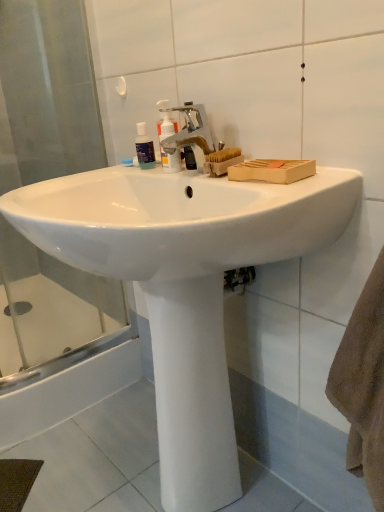
The height and width of the screenshot is (512, 384). What do you see at coordinates (165, 139) in the screenshot?
I see `translucent plastic pump bottle at center` at bounding box center [165, 139].

What do you see at coordinates (192, 395) in the screenshot? I see `white smooth pedestal at center` at bounding box center [192, 395].

Locate an element on the screen. translucent plastic pump bottle at center is located at coordinates (165, 139).

Is white smooth pedestal at center next to white glossy sink at center and touching it?

They are not placed beside each other.

Considering the relative sizes of white smooth pedestal at center and white glossy sink at center in the image provided, is white smooth pedestal at center bigger than white glossy sink at center?

Incorrect, white smooth pedestal at center is not larger than white glossy sink at center.

At what (x,y) coordinates should I click in order to perform the action: click on sink to the left of white smooth pedestal at center. Please return your answer as a coordinate pair (x, y). The height and width of the screenshot is (512, 384). Looking at the image, I should click on (179, 220).

Can you confirm if white smooth pedestal at center is positioned to the right of white glossy sink at center?

Indeed, white smooth pedestal at center is positioned on the right side of white glossy sink at center.

In the image, is silver metallic faucet at center positioned in front of or behind transparent plastic bottle at upper center?

silver metallic faucet at center is positioned closer to the viewer than transparent plastic bottle at upper center.

From the image's perspective, who appears lower, silver metallic faucet at center or transparent plastic bottle at upper center?

silver metallic faucet at center appears lower in the image.

Between silver metallic faucet at center and transparent plastic bottle at upper center, which one has smaller size?

Smaller between the two is transparent plastic bottle at upper center.

Is silver metallic faucet at center aimed at transparent plastic bottle at upper center?

No.

Would you say transparent plastic bottle at upper center is inside or outside translucent plastic pump bottle at center?

transparent plastic bottle at upper center is not enclosed by translucent plastic pump bottle at center.

From a real-world perspective, is transparent plastic bottle at upper center above or below translucent plastic pump bottle at center?

transparent plastic bottle at upper center is situated lower than translucent plastic pump bottle at center in the real world.

Is transparent plastic bottle at upper center thinner than translucent plastic pump bottle at center?

Yes, transparent plastic bottle at upper center is thinner than translucent plastic pump bottle at center.

Does transparent plastic bottle at upper center turn towards translucent plastic pump bottle at center?

No, transparent plastic bottle at upper center is not turned towards translucent plastic pump bottle at center.

Which object is more forward, transparent glass shower door at left or white smooth pedestal at center?

white smooth pedestal at center.

From a real-world perspective, is transparent glass shower door at left on top of white smooth pedestal at center?

Yes.

Is transparent glass shower door at left taller or shorter than white smooth pedestal at center?

transparent glass shower door at left is taller than white smooth pedestal at center.

Measure the distance from transparent glass shower door at left to white smooth pedestal at center.

transparent glass shower door at left and white smooth pedestal at center are 64.22 centimeters apart from each other.

Is white smooth pedestal at center bigger or smaller than transparent plastic bottle at upper center?

In the image, white smooth pedestal at center appears to be larger than transparent plastic bottle at upper center.

Could you tell me if white smooth pedestal at center is facing transparent plastic bottle at upper center?

No, white smooth pedestal at center is not turned towards transparent plastic bottle at upper center.

Are white smooth pedestal at center and transparent plastic bottle at upper center making contact?

white smooth pedestal at center is not next to transparent plastic bottle at upper center, and they're not touching.

Considering their positions, is translucent plastic pump bottle at center located in front of or behind transparent glass shower door at left?

Visually, translucent plastic pump bottle at center is located behind transparent glass shower door at left.

Is translucent plastic pump bottle at center not close to transparent glass shower door at left?

translucent plastic pump bottle at center is near transparent glass shower door at left, not far away.

Is transparent glass shower door at left at the back of translucent plastic pump bottle at center?

No, translucent plastic pump bottle at center's orientation is not away from transparent glass shower door at left.

From the image's perspective, is translucent plastic pump bottle at center on top of transparent glass shower door at left?

Yes, from the image's perspective, translucent plastic pump bottle at center is over transparent glass shower door at left.

Image resolution: width=384 pixels, height=512 pixels. Find the location of `shower door below the transparent plastic bottle at upper center (from the image's perspective)`. shower door below the transparent plastic bottle at upper center (from the image's perspective) is located at coordinates (58, 339).

From the image's perspective, which object appears higher, transparent plastic bottle at upper center or transparent glass shower door at left?

transparent plastic bottle at upper center appears higher in the image.

Is transparent plastic bottle at upper center oriented towards transparent glass shower door at left?

No, transparent plastic bottle at upper center does not turn towards transparent glass shower door at left.

Is transparent plastic bottle at upper center wider than transparent glass shower door at left?

In fact, transparent plastic bottle at upper center might be narrower than transparent glass shower door at left.

The width and height of the screenshot is (384, 512). In order to click on sink on the left of white smooth pedestal at center in this screenshot , I will do `click(179, 220)`.

At what (x,y) coordinates should I click in order to perform the action: click on toiletry lying above the silver metallic faucet at center (from the image's perspective). Please return your answer as a coordinate pair (x, y). The width and height of the screenshot is (384, 512). Looking at the image, I should click on (144, 147).

When comparing their distances from transparent plastic bottle at upper center, does white smooth pedestal at center or silver metallic faucet at center seem closer?

Among the two, silver metallic faucet at center is located nearer to transparent plastic bottle at upper center.

Considering their positions, is silver metallic faucet at center positioned closer to transparent plastic bottle at upper center than white smooth pedestal at center?

Among the two, silver metallic faucet at center is located nearer to transparent plastic bottle at upper center.

In the scene shown: Looking at the image, which one is located closer to white glossy sink at center, silver metallic faucet at center or transparent glass shower door at left?

silver metallic faucet at center lies closer to white glossy sink at center than the other object.

Based on their spatial positions, is white glossy sink at center or transparent glass shower door at left further from white smooth pedestal at center?

The object further to white smooth pedestal at center is transparent glass shower door at left.

Considering their positions, is translucent plastic pump bottle at center positioned closer to transparent plastic bottle at upper center than transparent glass shower door at left?

translucent plastic pump bottle at center lies closer to transparent plastic bottle at upper center than the other object.

Estimate the real-world distances between objects in this image. Which object is further from white smooth pedestal at center, transparent plastic bottle at upper center or silver metallic faucet at center?

Based on the image, transparent plastic bottle at upper center appears to be further to white smooth pedestal at center.

Based on their spatial positions, is translucent plastic pump bottle at center or silver metallic faucet at center further from transparent plastic bottle at upper center?

The object further to transparent plastic bottle at upper center is silver metallic faucet at center.

When comparing their distances from transparent glass shower door at left, does translucent plastic pump bottle at center or silver metallic faucet at center seem further?

silver metallic faucet at center lies further to transparent glass shower door at left than the other object.

Find the location of a particular element. shower door between white glossy sink at center and translucent plastic pump bottle at center in the front-back direction is located at coordinates (58, 339).

This screenshot has width=384, height=512. I want to click on shower door positioned between white glossy sink at center and transparent plastic bottle at upper center from near to far, so click(x=58, y=339).

I want to click on shower door that lies between transparent plastic bottle at upper center and white smooth pedestal at center from top to bottom, so click(x=58, y=339).

Locate an element on the screen. The width and height of the screenshot is (384, 512). toiletry between transparent glass shower door at left and silver metallic faucet at center is located at coordinates (144, 147).